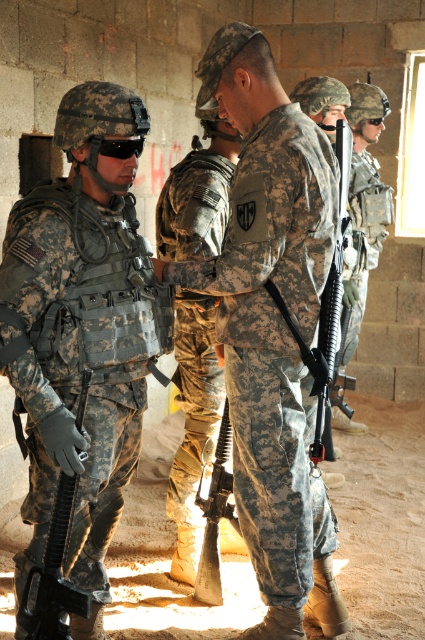
Question: Among these points, which one is nearest to the camera?

Choices:
 (A) (184, 314)
 (B) (365, 257)

Answer: (A)

Question: Which of the following is the farthest from the observer?

Choices:
 (A) (215, 592)
 (B) (54, 570)

Answer: (A)

Question: In this image, where is black matte rifle at center located relative to matte black rifle at center?

Choices:
 (A) right
 (B) left

Answer: (A)

Question: Is camouflage fabric uniform at center above camouflage fabric uniform at right?

Choices:
 (A) yes
 (B) no

Answer: (B)

Question: Considering the real-world distances, which object is farthest from the matte black rifle at left?

Choices:
 (A) black matte rifle at center
 (B) matte black rifle at center
 (C) camouflage uniform at left

Answer: (A)

Question: Can you confirm if camouflage fabric uniform at center is bigger than camouflage fabric uniform at right?

Choices:
 (A) no
 (B) yes

Answer: (B)